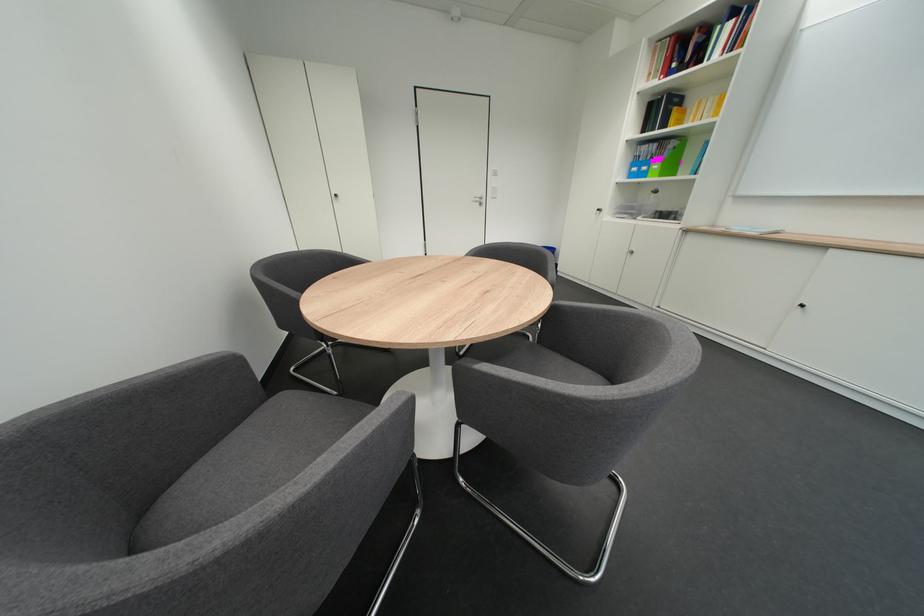
Image resolution: width=924 pixels, height=616 pixels. I want to click on white cabinet handle, so (335, 196).